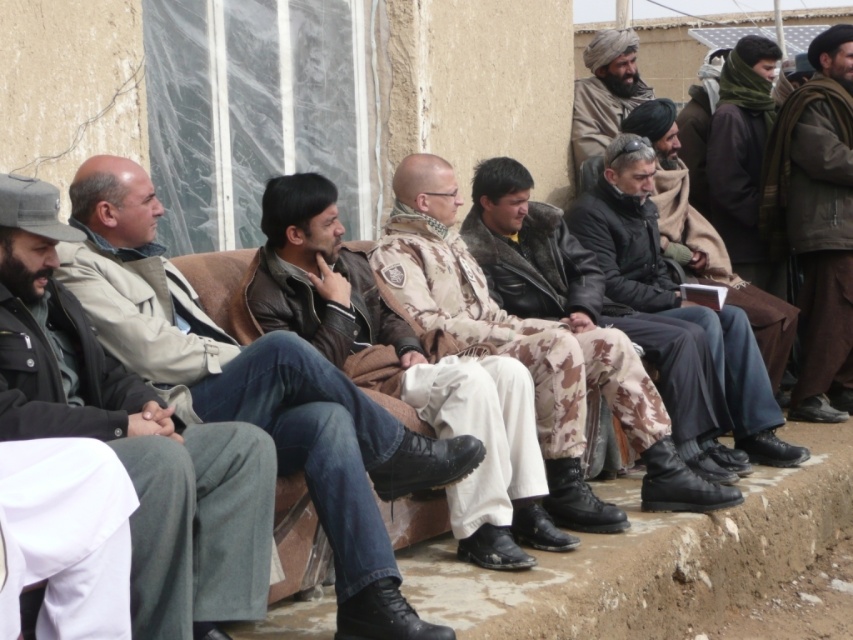
Based on the photo, you are a photographer trying to capture a clear shot of the camouflage pants at center and the camouflage uniform at center. Which one is positioned higher in the image?

The camouflage pants at center is above camouflage uniform at center in the image.

You are a photographer trying to capture a portrait of the person wearing camouflage pants at center. The camera you are using has a focal length of 50mm and an aperture of f2.8. If you want to ensure the entire person is in focus, what should you consider based on their position at point 0.509, 0.702?

The position of camouflage pants at center is at point (598,324), so you should focus at the hyperfocal distance to ensure the entire scene from the foreground to the background is sharp. This technique is especially useful given the camera settings of 50mm and f2.8.